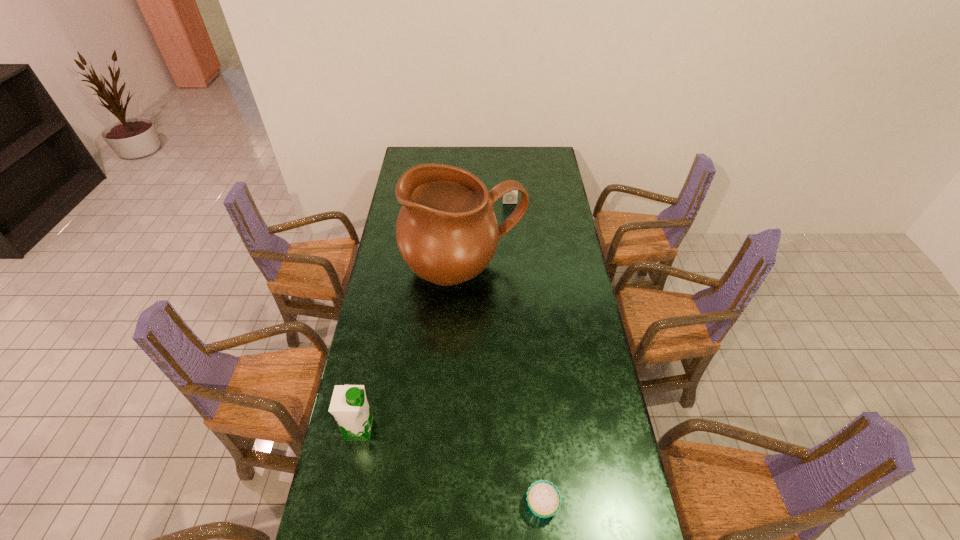
Identify the location of vacant space in between the cupcake and the tallest object. The image size is (960, 540). (503, 386).

In order to click on vacant area that lies between the cream pitcher and the second tallest object in this screenshot , I will do pos(412,349).

Locate an element on the screen. The width and height of the screenshot is (960, 540). free space between the second farthest object and the cupcake is located at coordinates (503, 386).

Identify the location of empty space between the iPod and the third shortest object. This screenshot has width=960, height=540. (435, 316).

Where is `vacant area between the third shortest object and the farthest object`? vacant area between the third shortest object and the farthest object is located at coordinates (435, 316).

In order to click on vacant space in between the tallest object and the third shortest object in this screenshot , I will do `click(412, 349)`.

At what (x,y) coordinates should I click in order to perform the action: click on object that is the closest to the farthest object. Please return your answer as a coordinate pair (x, y). The image size is (960, 540). Looking at the image, I should click on (447, 233).

Locate which object is the third closest to the iPod. Please provide its 2D coordinates. Your answer should be formatted as a tuple, i.e. [(x, y)], where the tuple contains the x and y coordinates of a point satisfying the conditions above.

[(544, 499)]

This screenshot has height=540, width=960. In order to click on free space in the image that satisfies the following two spatial constraints: 1. on the front-facing side of the nearest object; 2. on the right side of the iPod in this screenshot , I will do `click(533, 504)`.

You are a GUI agent. You are given a task and a screenshot of the screen. Output one action in this format:
    pyautogui.click(x=<x>, y=<y>)
    Task: Click on the vacant region that satisfies the following two spatial constraints: 1. at the spout of the third nearest object; 2. on the front-facing side of the second tallest object
    Image resolution: width=960 pixels, height=540 pixels.
    Given the screenshot: What is the action you would take?
    pyautogui.click(x=458, y=429)